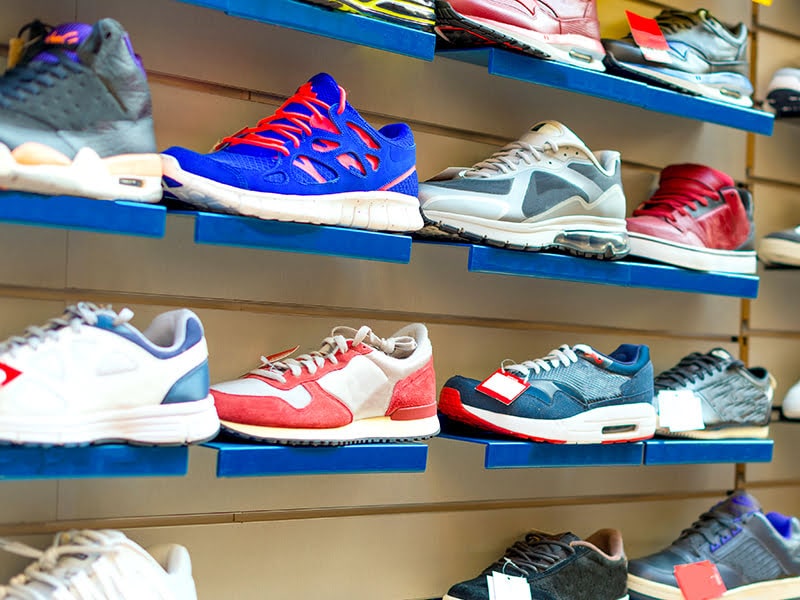
You are a GUI agent. You are given a task and a screenshot of the screen. Output one action in this format:
    pyautogui.click(x=<x>, y=<y>)
    Task: Click on the lines in wall
    The height and width of the screenshot is (600, 800).
    Given the screenshot: What is the action you would take?
    pyautogui.click(x=782, y=32), pyautogui.click(x=753, y=35), pyautogui.click(x=773, y=186), pyautogui.click(x=446, y=132), pyautogui.click(x=470, y=326), pyautogui.click(x=780, y=332), pyautogui.click(x=329, y=515), pyautogui.click(x=766, y=487)